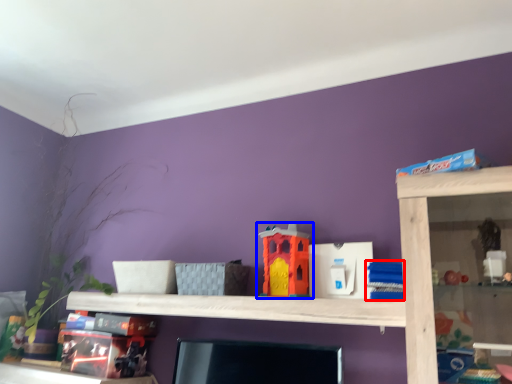
Question: Which of the following is the farthest to the observer, toy (highlighted by a red box) or toy (highlighted by a blue box)?

Choices:
 (A) toy
 (B) toy

Answer: (B)